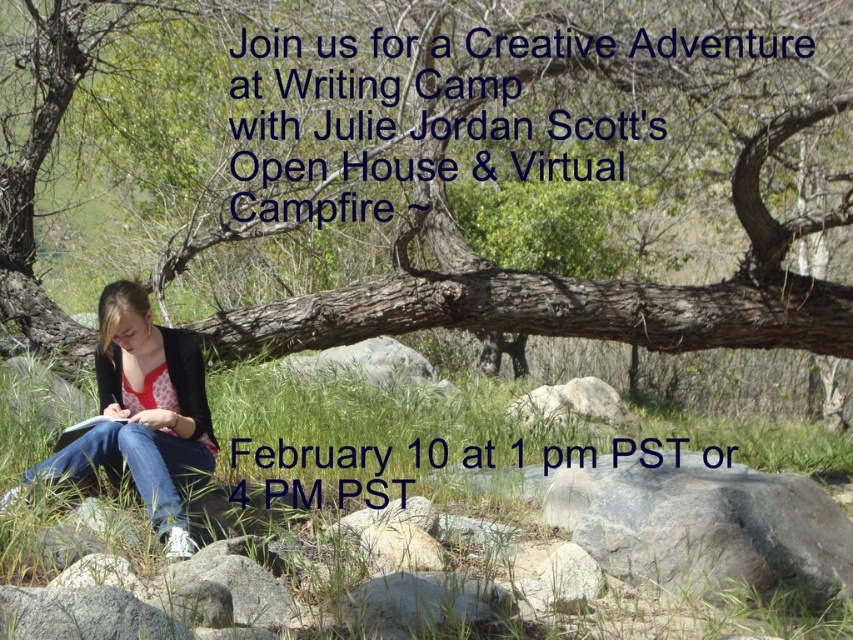
Who is more distant from viewer, (393, 296) or (637, 525)?

The point (393, 296) is more distant.

Between brown rough tree trunk at center and gray rough rock at lower right, which one is positioned higher?

Positioned higher is brown rough tree trunk at center.

Who is more distant from viewer, (618, 305) or (814, 506)?

The point (618, 305) is behind.

I want to click on brown rough tree trunk at center, so click(x=579, y=285).

Does brown rough tree trunk at center have a greater width compared to green grass at lower center?

Indeed, brown rough tree trunk at center has a greater width compared to green grass at lower center.

At what (x,y) coordinates should I click in order to perform the action: click on brown rough tree trunk at center. Please return your answer as a coordinate pair (x, y). Image resolution: width=853 pixels, height=640 pixels. Looking at the image, I should click on (579, 285).

Is gray rough rock at lower right closer to the viewer compared to matte black jacket at lower left?

No.

Which of these two, gray rough rock at lower right or matte black jacket at lower left, stands taller?

With more height is matte black jacket at lower left.

Who is more distant from viewer, (x=805, y=513) or (x=148, y=490)?

Positioned behind is point (x=805, y=513).

Image resolution: width=853 pixels, height=640 pixels. In order to click on gray rough rock at lower right in this screenshot , I will do pos(705,525).